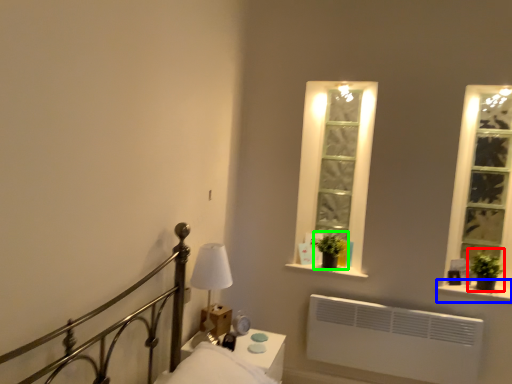
Question: Considering the real-world distances, which object is closest to plant (highlighted by a red box)? window sill (highlighted by a blue box) or plant (highlighted by a green box).

Choices:
 (A) window sill
 (B) plant

Answer: (A)